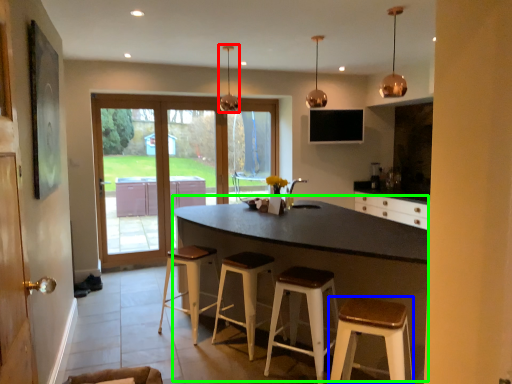
Question: Which is farther away from light fixture (highlighted by a red box)? stool (highlighted by a blue box) or table (highlighted by a green box)?

Choices:
 (A) stool
 (B) table

Answer: (A)